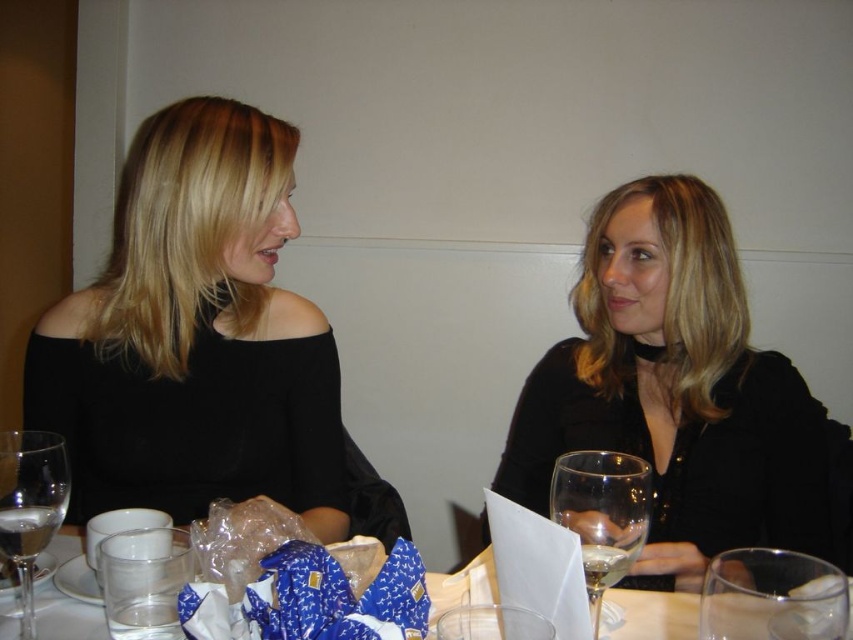
Question: Which point is closer to the camera?

Choices:
 (A) (625, 461)
 (B) (27, 454)
 (C) (210, 416)
 (D) (766, 620)

Answer: (D)

Question: Can you confirm if black matte off-shoulder top at left is positioned below black matte dress at center?

Choices:
 (A) no
 (B) yes

Answer: (A)

Question: Is black matte dress at center smaller than clear glass water at lower center?

Choices:
 (A) yes
 (B) no

Answer: (B)

Question: Does transparent glass at center appear on the right side of clear glass water at lower center?

Choices:
 (A) yes
 (B) no

Answer: (B)

Question: Which object appears farthest from the camera in this image?

Choices:
 (A) clear glass water at lower center
 (B) transparent glass at lower right
 (C) transparent glass at center

Answer: (A)

Question: Among these objects, which one is farthest from the camera?

Choices:
 (A) black matte off-shoulder top at left
 (B) transparent glass at lower right

Answer: (A)